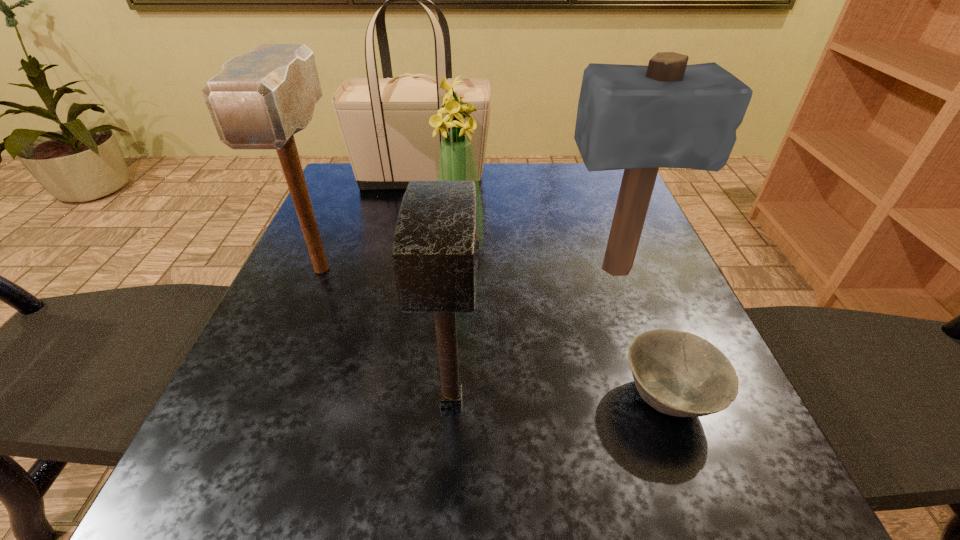
You are a GUI agent. You are given a task and a screenshot of the screen. Output one action in this format:
    pyautogui.click(x=<x>, y=<y>)
    Task: Click on the vacant space that satisfies the following two spatial constraints: 1. on the front-facing side of the bouquet; 2. on the back side of the rightmost mallet
    This screenshot has height=540, width=960.
    Given the screenshot: What is the action you would take?
    pyautogui.click(x=459, y=270)

The image size is (960, 540). I want to click on free space that satisfies the following two spatial constraints: 1. on the front-facing side of the shortest object; 2. on the left side of the bouquet, so click(x=452, y=397).

What are the coordinates of `vacant position in the image that satisfies the following two spatial constraints: 1. with handles facing forward on the rightmost mallet; 2. on the left side of the shopping bag` in the screenshot? It's located at (403, 270).

Where is `free space that satisfies the following two spatial constraints: 1. on the back side of the shortest object; 2. with handles facing forward on the farthest object`? free space that satisfies the following two spatial constraints: 1. on the back side of the shortest object; 2. with handles facing forward on the farthest object is located at coordinates (586, 178).

I want to click on free space that satisfies the following two spatial constraints: 1. on the front-facing side of the bouquet; 2. on the right side of the rightmost mallet, so click(459, 270).